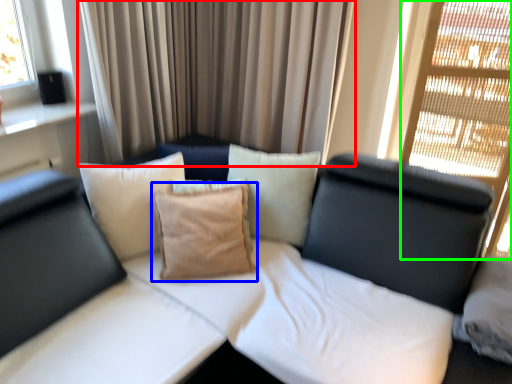
Question: Based on their relative distances, which object is nearer to curtain (highlighted by a red box)? Choose from pillow (highlighted by a blue box) and glass door (highlighted by a green box).

Choices:
 (A) pillow
 (B) glass door

Answer: (A)